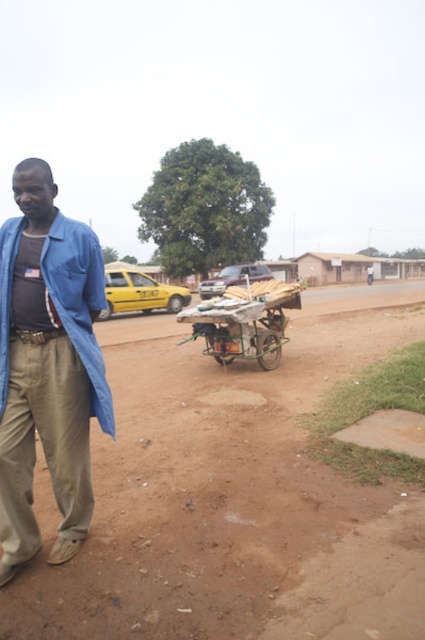
Question: Which point is closer to the camera?

Choices:
 (A) blue cotton jacket at lower left
 (B) brown dirt field at center
 (C) khaki cotton pants at lower left

Answer: (B)

Question: Does brown dirt field at center have a greater width compared to wooden cart at center?

Choices:
 (A) no
 (B) yes

Answer: (B)

Question: Does brown dirt field at center appear on the left side of khaki cotton pants at lower left?

Choices:
 (A) yes
 (B) no

Answer: (B)

Question: Which of the following is the farthest from the observer?

Choices:
 (A) khaki cotton pants at lower left
 (B) blue cotton jacket at lower left
 (C) brown dirt field at center

Answer: (B)

Question: Among these objects, which one is nearest to the camera?

Choices:
 (A) brown dirt field at center
 (B) wooden cart at center
 (C) blue cotton jacket at lower left

Answer: (A)

Question: Does brown dirt field at center appear on the right side of khaki cotton pants at lower left?

Choices:
 (A) no
 (B) yes

Answer: (B)